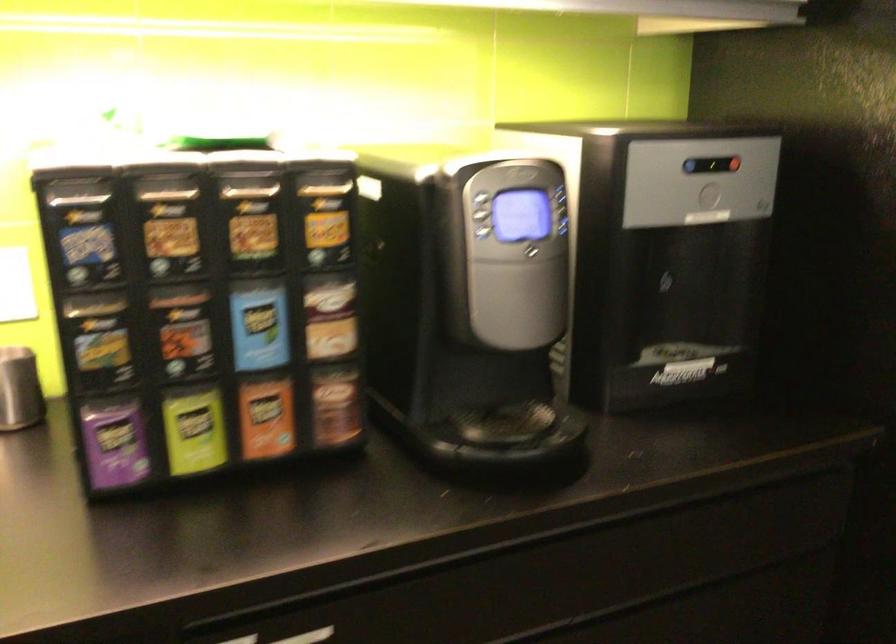
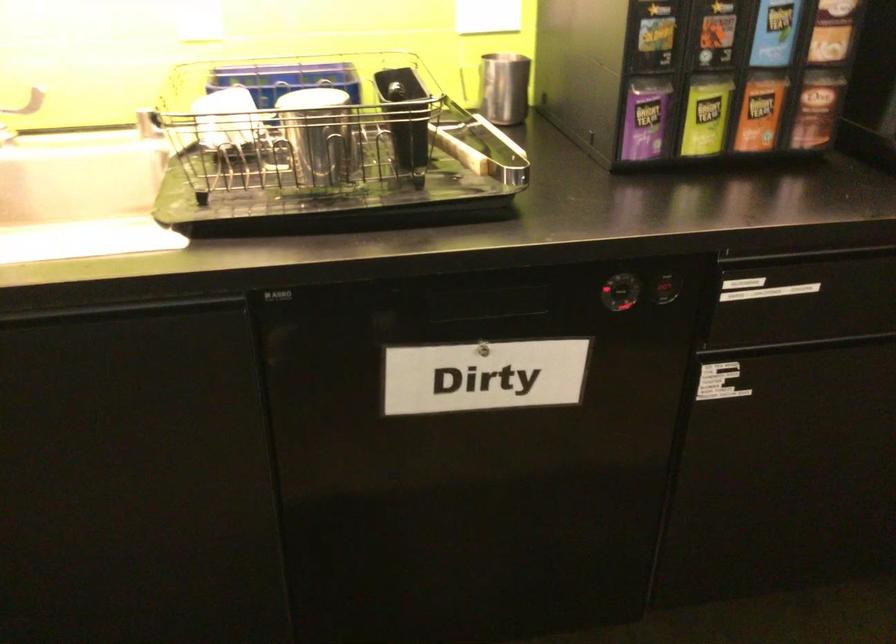
Question: Based on the continuous images, in which direction is the camera rotating? Reply with the corresponding letter.

Choices:
 (A) Left
 (B) Right
 (C) Up
 (D) Down

Answer: (D)